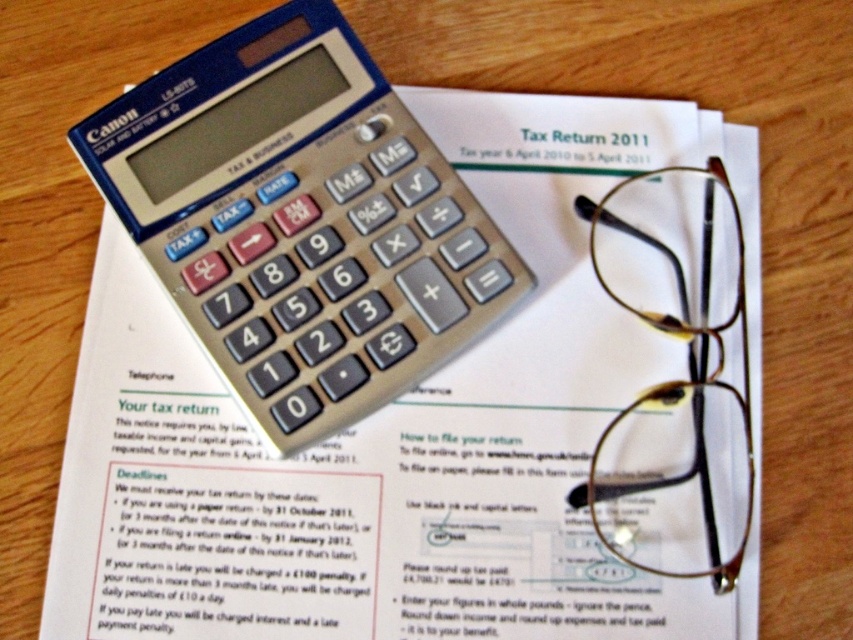
You are preparing a tax return and need to place the silver metallic calculator at center on the white paper at upper center. Can the calculator fit entirely on the paper without overlapping the edges?

The white paper at upper center is wider than the silver metallic calculator at center, so the calculator can fit entirely on the paper without overlapping the edges.

You are an accountant trying to locate the tax return form on your desk. You see the white paper at upper center and the silver metallic calculator at center. Which object is positioned to the right of the other?

The white paper at upper center is to the right of the silver metallic calculator at center according to the description.